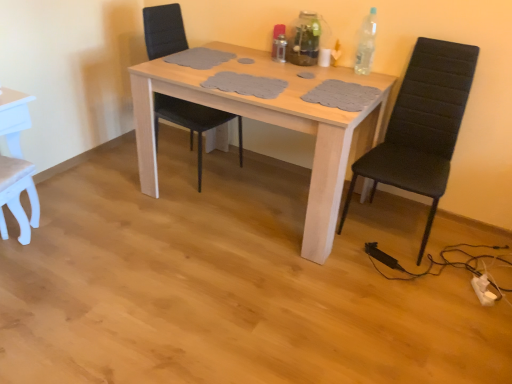
Where is `spots to the right of white matte chair at lower left, which ranks as the first chair in left-to-right order`? Image resolution: width=512 pixels, height=384 pixels. spots to the right of white matte chair at lower left, which ranks as the first chair in left-to-right order is located at coordinates (62, 261).